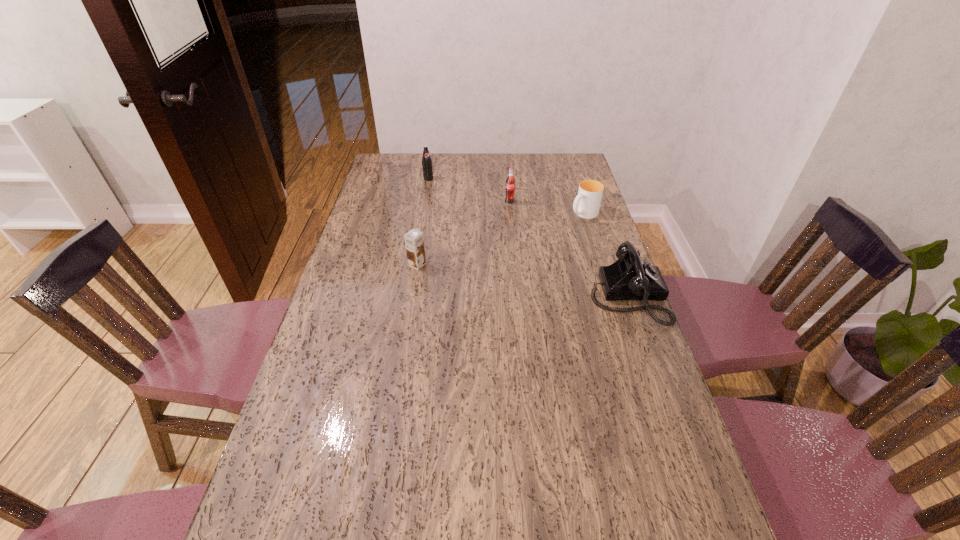
You are a GUI agent. You are given a task and a screenshot of the screen. Output one action in this format:
    pyautogui.click(x=<x>, y=<y>)
    Task: Click on the vacant spot on the desktop that is between the chocolate milk and the telephone and is positioned on the label of the nearer pop
    This screenshot has height=540, width=960.
    Given the screenshot: What is the action you would take?
    pyautogui.click(x=544, y=284)

This screenshot has width=960, height=540. Identify the location of vacant space on the desktop that is between the chocolate milk and the telephone and is positioned on the front label of the farther pop. (492, 275).

Image resolution: width=960 pixels, height=540 pixels. In order to click on vacant space on the desktop that is between the chocolate milk and the telephone and is positioned with the handle on the side of the shortest object in this screenshot , I will do `click(489, 275)`.